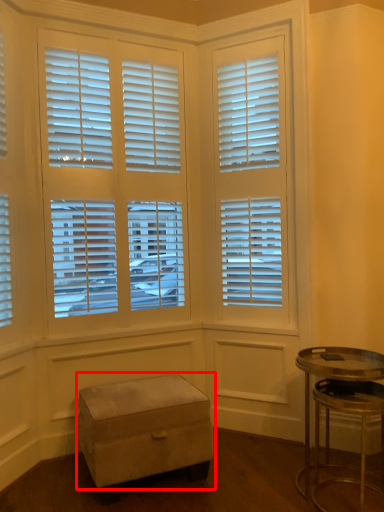
Question: Where is step stool (annotated by the red box) located in relation to table in the image?

Choices:
 (A) left
 (B) right

Answer: (A)